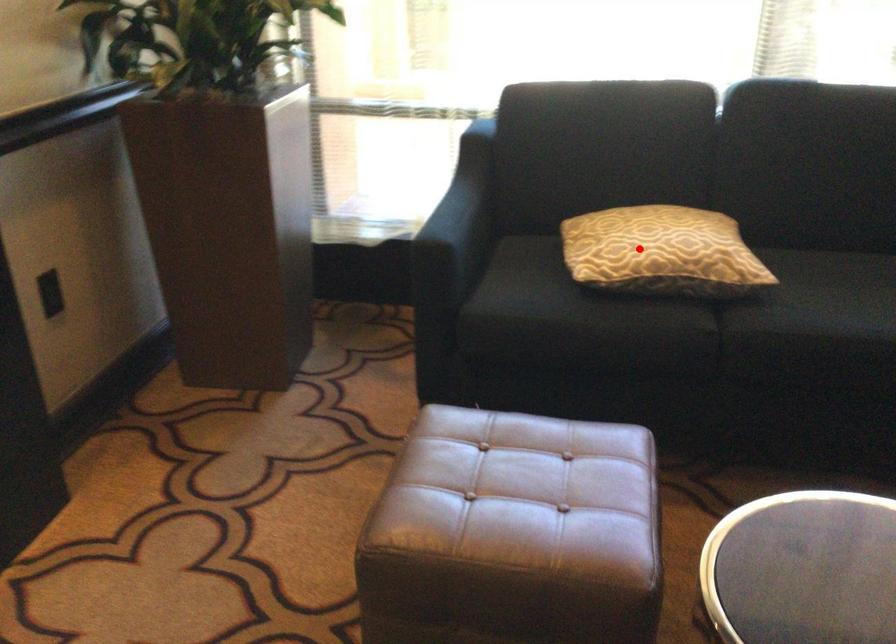
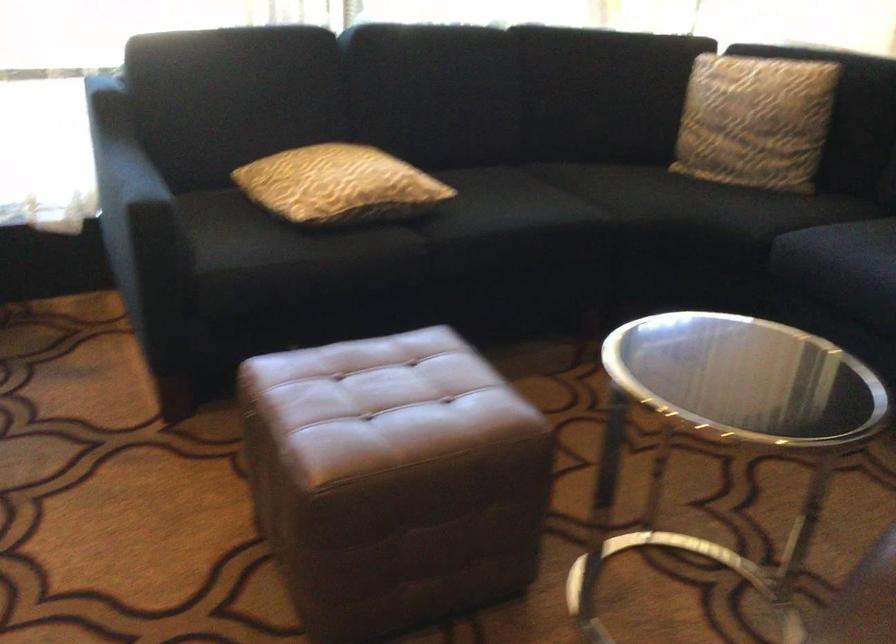
Locate, in the second image, the point that corresponds to the highlighted location in the first image.

(339, 185)